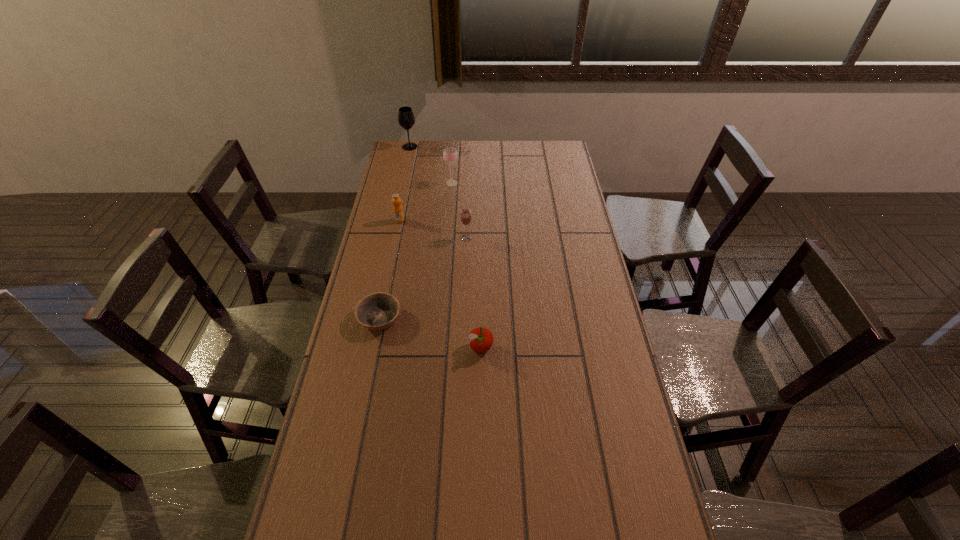
Identify the location of free point between the shortest object and the nearest object. The width and height of the screenshot is (960, 540). (430, 334).

Where is `vacant point located between the nearest object and the second nearest object`? vacant point located between the nearest object and the second nearest object is located at coordinates (430, 334).

The height and width of the screenshot is (540, 960). I want to click on vacant space in between the fifth nearest object and the shortest wineglass, so click(x=459, y=211).

Where is `free point between the shortest object and the apple`? The height and width of the screenshot is (540, 960). free point between the shortest object and the apple is located at coordinates (430, 334).

Identify the location of blank region between the nearest wineglass and the second nearest object. This screenshot has height=540, width=960. (423, 278).

This screenshot has height=540, width=960. What are the coordinates of `empty space that is in between the third object from right to left and the second shortest object` in the screenshot? It's located at (467, 266).

Locate an element on the screen. object that stands as the closest to the rightmost wineglass is located at coordinates 398,213.

Locate which object ranks fifth in proximity to the rightmost wineglass. Please provide its 2D coordinates. Your answer should be formatted as a tuple, i.e. [(x, y)], where the tuple contains the x and y coordinates of a point satisfying the conditions above.

[(406, 119)]

Identify the location of the third closest wineglass to the third farthest object. (406, 119).

Select which wineglass is the second closest to the bowl. Please provide its 2D coordinates. Your answer should be formatted as a tuple, i.e. [(x, y)], where the tuple contains the x and y coordinates of a point satisfying the conditions above.

[(450, 155)]